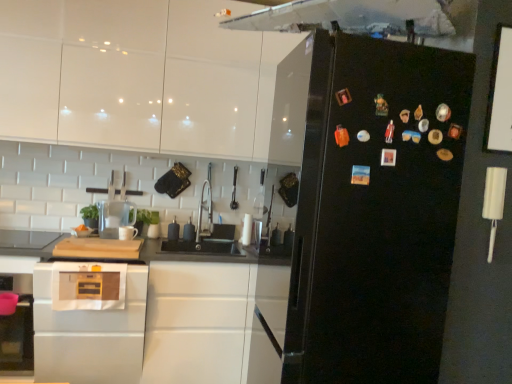
Question: From the image's perspective, would you say black glossy refrigerator at right is shown under white glossy cabinet at lower left, placed as the 1th cabinetry when sorted from bottom to top?

Choices:
 (A) no
 (B) yes

Answer: (A)

Question: Is black glossy refrigerator at right not near white glossy cabinet at lower left, the second cabinetry viewed from the top?

Choices:
 (A) yes
 (B) no

Answer: (A)

Question: Can you confirm if black glossy refrigerator at right is shorter than white glossy cabinet at lower left, placed as the 1th cabinetry when sorted from bottom to top?

Choices:
 (A) yes
 (B) no

Answer: (B)

Question: Considering the relative positions of black glossy refrigerator at right and white glossy cabinet at lower left, the second cabinetry viewed from the top, in the image provided, is black glossy refrigerator at right to the left of white glossy cabinet at lower left, the second cabinetry viewed from the top, from the viewer's perspective?

Choices:
 (A) yes
 (B) no

Answer: (B)

Question: Would you say black glossy refrigerator at right is outside white glossy cabinet at lower left, the second cabinetry viewed from the top?

Choices:
 (A) yes
 (B) no

Answer: (A)

Question: Is black glossy refrigerator at right oriented away from white glossy cabinet at lower left, the second cabinetry viewed from the top?

Choices:
 (A) yes
 (B) no

Answer: (B)

Question: Is satin silver oven at lower left positioned with its back to black glossy refrigerator at right?

Choices:
 (A) yes
 (B) no

Answer: (B)

Question: From the image's perspective, would you say satin silver oven at lower left is positioned over black glossy refrigerator at right?

Choices:
 (A) no
 (B) yes

Answer: (A)

Question: Can you confirm if satin silver oven at lower left is smaller than black glossy refrigerator at right?

Choices:
 (A) no
 (B) yes

Answer: (B)

Question: From a real-world perspective, is satin silver oven at lower left physically above black glossy refrigerator at right?

Choices:
 (A) no
 (B) yes

Answer: (A)

Question: From a real-world perspective, is satin silver oven at lower left physically below black glossy refrigerator at right?

Choices:
 (A) yes
 (B) no

Answer: (A)

Question: Does satin silver oven at lower left lie in front of black glossy refrigerator at right?

Choices:
 (A) no
 (B) yes

Answer: (A)

Question: Can we say black glossy refrigerator at right lies outside satin silver oven at lower left?

Choices:
 (A) no
 (B) yes

Answer: (B)